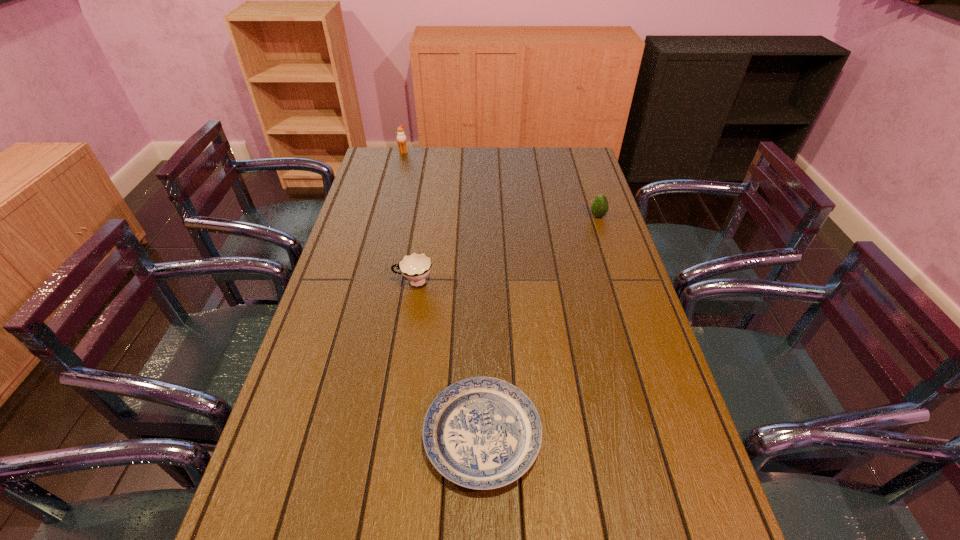
The height and width of the screenshot is (540, 960). In order to click on vacant space that satisfies the following two spatial constraints: 1. on the side of the second object from left to right with the handle; 2. at the front with a straw on the leftmost object in this screenshot , I will do `click(434, 153)`.

Locate an element on the screen. vacant point that satisfies the following two spatial constraints: 1. at the front with a straw on the icecream; 2. on the right side of the third nearest object is located at coordinates (387, 216).

The image size is (960, 540). What are the coordinates of `vacant space that satisfies the following two spatial constraints: 1. at the front with a straw on the farthest object; 2. on the side of the cup with the handle` in the screenshot? It's located at (371, 282).

You are a GUI agent. You are given a task and a screenshot of the screen. Output one action in this format:
    pyautogui.click(x=<x>, y=<y>)
    Task: Click on the free space that satisfies the following two spatial constraints: 1. at the front with a straw on the leftmost object; 2. on the side of the second nearest object with the handle
    The height and width of the screenshot is (540, 960).
    Given the screenshot: What is the action you would take?
    pyautogui.click(x=371, y=282)

At what (x,y) coordinates should I click in order to perform the action: click on vacant space that satisfies the following two spatial constraints: 1. on the side of the third nearest object with the handle; 2. on the left side of the cup. Please return your answer as a coordinate pair (x, y). Looking at the image, I should click on (423, 216).

At what (x,y) coordinates should I click in order to perform the action: click on vacant area that satisfies the following two spatial constraints: 1. on the side of the second nearest object with the handle; 2. on the left side of the rightmost object. Please return your answer as a coordinate pair (x, y). This screenshot has height=540, width=960. Looking at the image, I should click on (423, 216).

Where is `vacant point that satisfies the following two spatial constraints: 1. on the back side of the second farthest object; 2. on the left side of the shortest object`? This screenshot has height=540, width=960. vacant point that satisfies the following two spatial constraints: 1. on the back side of the second farthest object; 2. on the left side of the shortest object is located at coordinates (481, 216).